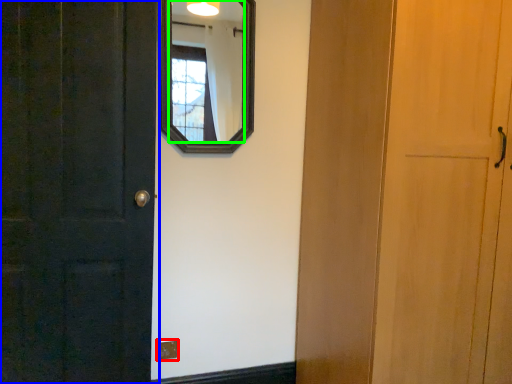
Question: Which object is positioned closest to electric outlet (highlighted by a red box)? Select from door (highlighted by a blue box) and mirror (highlighted by a green box).

Choices:
 (A) door
 (B) mirror

Answer: (A)